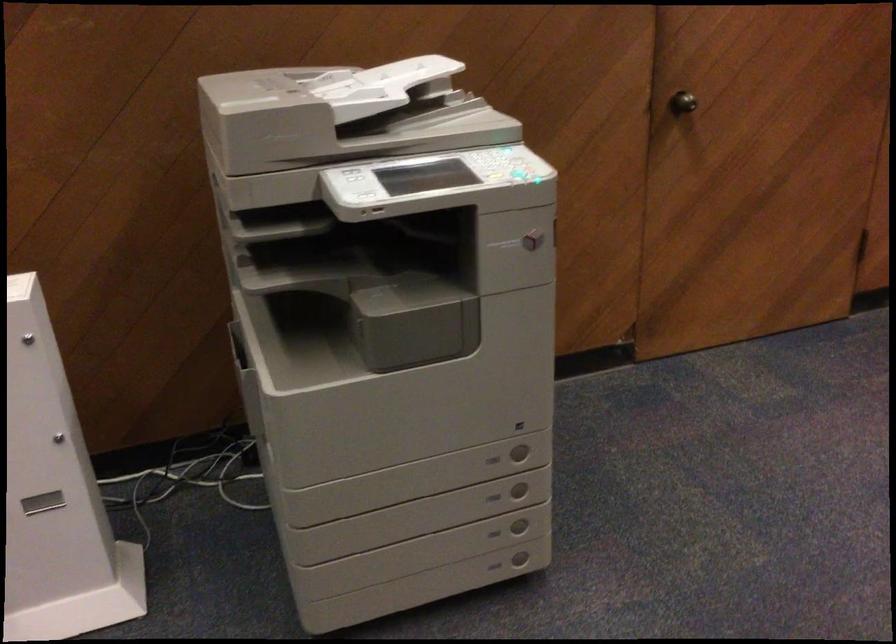
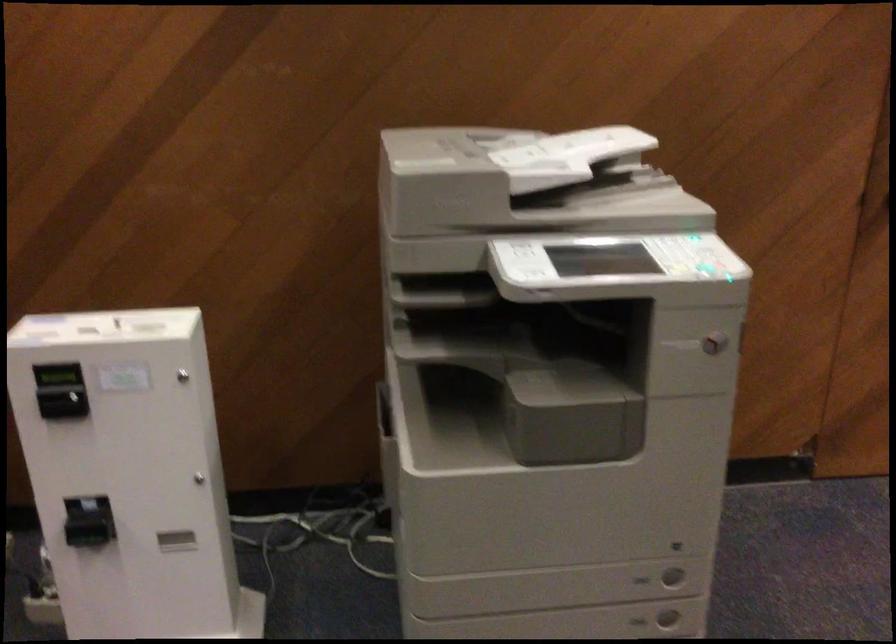
Question: The images are taken continuously from a first-person perspective. In which direction is your viewpoint rotating?

Choices:
 (A) Left
 (B) Right
 (C) Up
 (D) Down

Answer: (A)